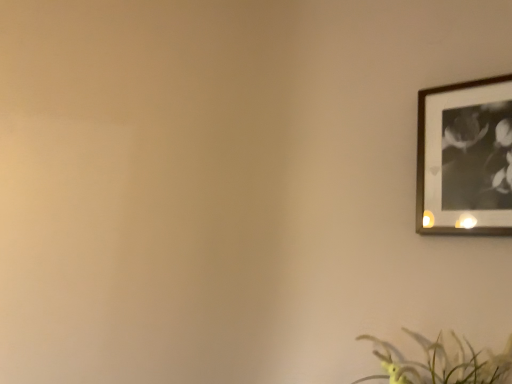
Question: Should I look upward or downward to see silver metallic picture frame at upper right?

Choices:
 (A) up
 (B) down

Answer: (A)